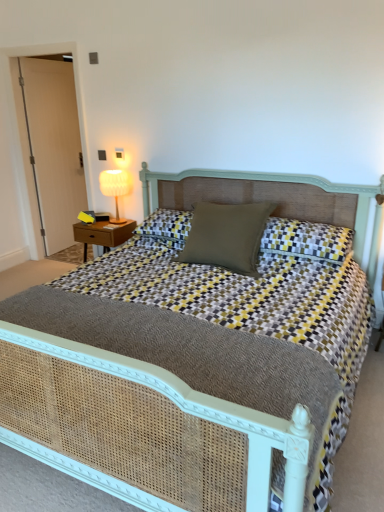
Question: Can we say yellow-and-gray checkered pillow at center, the 2th pillow when ordered from left to right, lies outside woven cane bed at center?

Choices:
 (A) no
 (B) yes

Answer: (A)

Question: Does yellow-and-gray checkered pillow at center, the first pillow viewed from the right, have a larger size compared to woven cane bed at center?

Choices:
 (A) no
 (B) yes

Answer: (A)

Question: Considering the relative sizes of yellow-and-gray checkered pillow at center, the first pillow viewed from the right, and woven cane bed at center in the image provided, is yellow-and-gray checkered pillow at center, the first pillow viewed from the right, taller than woven cane bed at center?

Choices:
 (A) yes
 (B) no

Answer: (B)

Question: Is yellow-and-gray checkered pillow at center, the 2th pillow when ordered from left to right, facing away from woven cane bed at center?

Choices:
 (A) yes
 (B) no

Answer: (A)

Question: Is the position of yellow-and-gray checkered pillow at center, the first pillow viewed from the right, more distant than that of woven cane bed at center?

Choices:
 (A) yes
 (B) no

Answer: (A)

Question: Considering the relative positions of yellow-and-gray checkered pillow at center, the first pillow viewed from the right, and white wood door at left in the image provided, is yellow-and-gray checkered pillow at center, the first pillow viewed from the right, to the left or to the right of white wood door at left?

Choices:
 (A) left
 (B) right

Answer: (B)

Question: Is yellow-and-gray checkered pillow at center, the first pillow viewed from the right, in front of or behind white wood door at left in the image?

Choices:
 (A) front
 (B) behind

Answer: (A)

Question: Is yellow-and-gray checkered pillow at center, the first pillow viewed from the right, inside the boundaries of white wood door at left, or outside?

Choices:
 (A) inside
 (B) outside

Answer: (B)

Question: From the image's perspective, is yellow-and-gray checkered pillow at center, the 2th pillow when ordered from left to right, located above or below white wood door at left?

Choices:
 (A) above
 (B) below

Answer: (B)

Question: From a real-world perspective, relative to yellow-and-gray checkered pillow at center, the 2th pillow when ordered from left to right, is white fabric lampshade at upper left vertically above or below?

Choices:
 (A) above
 (B) below

Answer: (A)

Question: From the image's perspective, is white fabric lampshade at upper left positioned above or below yellow-and-gray checkered pillow at center, the first pillow viewed from the right?

Choices:
 (A) below
 (B) above

Answer: (B)

Question: Visually, is white fabric lampshade at upper left positioned to the left or to the right of yellow-and-gray checkered pillow at center, the 2th pillow when ordered from left to right?

Choices:
 (A) right
 (B) left

Answer: (B)

Question: Is point pos(107,188) positioned closer to the camera than point pos(299,223)?

Choices:
 (A) closer
 (B) farther

Answer: (B)

Question: In the image, is white wood door at left on the left side or the right side of yellow-and-gray checkered pillow at center, the 2th pillow when ordered from left to right?

Choices:
 (A) right
 (B) left

Answer: (B)

Question: Is white wood door at left wider or thinner than yellow-and-gray checkered pillow at center, the first pillow viewed from the right?

Choices:
 (A) thin
 (B) wide

Answer: (A)